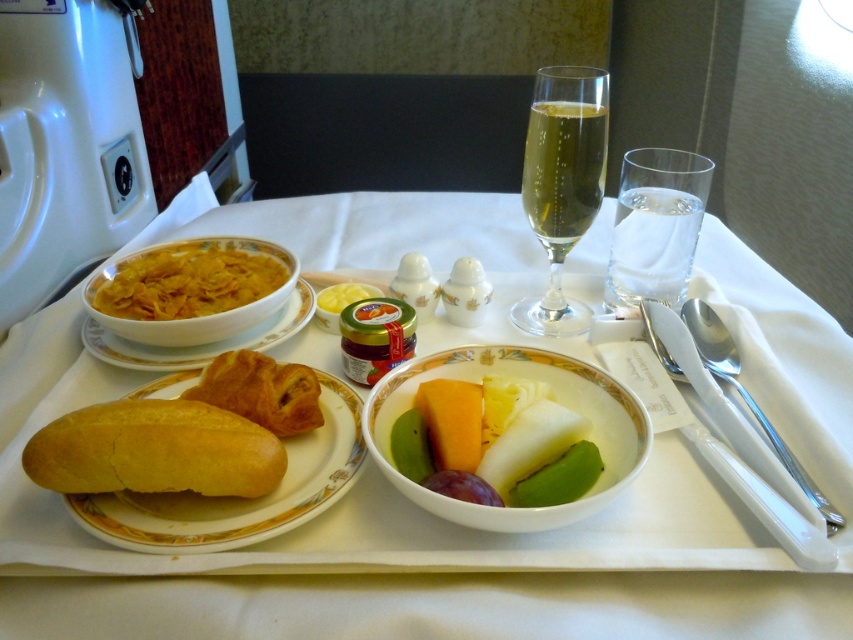
You are a flight attendant checking the meal tray. You need to place a napkin between the golden bread at lower left and the matte porcelain bowl at upper left. Which object should you place the napkin closer to to ensure it is between them?

You should place the napkin closer to the matte porcelain bowl at upper left because the golden bread at lower left is closer to the viewer, so the bowl is further back. Placing the napkin near the bowl would position it between the two objects.

You are a flight attendant preparing to serve a meal. You need to place a new dessert plate between the white porcelain tray at center and the clear glass champagne flute at upper center. Considering their sizes, will the dessert plate fit between them?

The white porcelain tray at center is larger in size than the clear glass champagne flute at upper center. Therefore, there is sufficient space between them to place the dessert plate.